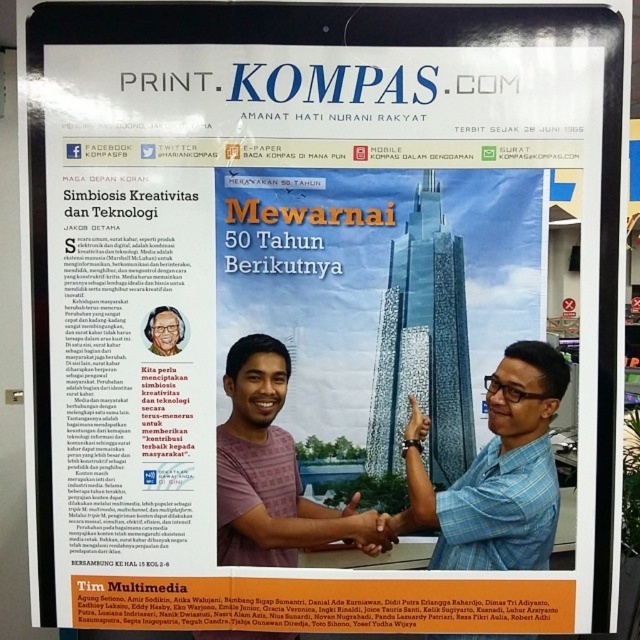
You are an artist who wants to paint the scene displayed on PRINT.KOMPAS.COM. You notice two elements at the center of the image, the matte blue hand at center and the black leather bracelet at center. Which one is positioned lower in the image?

The matte blue hand at center is located below the black leather bracelet at center, so the matte blue hand at center is positioned lower in the image.

You are a photographer standing in front of the skyscraper in the image. You want to take a photo that includes both the matte black glasses at upper left and the black leather bracelet at center. If your camera has a maximum focus range of 18 inches, will you be able to capture both objects in focus at the same time?

The matte black glasses at upper left is 19.96 inches away from the black leather bracelet at center. Since the distance between them exceeds the camera maximum focus range of 18 inches, you cannot capture both objects in focus simultaneously.

What are the coordinates of the blue checkered shirt at center in the image?

The blue checkered shirt at center is located at coordinates point (499, 474).